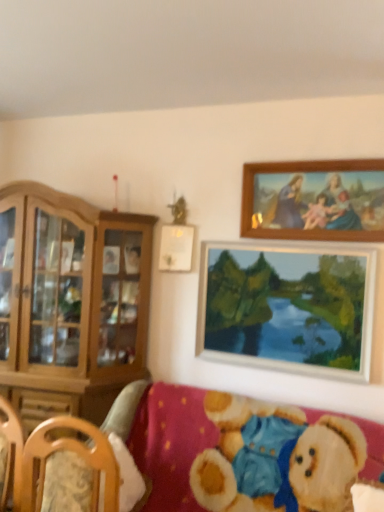
Question: Is wooden picture frame at upper center, the 2th picture frame in the bottom-to-top sequence, shorter than velvet teddy bear at lower right?

Choices:
 (A) yes
 (B) no

Answer: (A)

Question: Considering the relative positions of wooden picture frame at upper center, which ranks as the 2th picture frame in top-to-bottom order, and velvet teddy bear at lower right in the image provided, is wooden picture frame at upper center, which ranks as the 2th picture frame in top-to-bottom order, in front of velvet teddy bear at lower right?

Choices:
 (A) yes
 (B) no

Answer: (B)

Question: Is the depth of wooden picture frame at upper center, which ranks as the 2th picture frame in top-to-bottom order, greater than that of velvet teddy bear at lower right?

Choices:
 (A) no
 (B) yes

Answer: (B)

Question: From the image's perspective, does wooden picture frame at upper center, which ranks as the 2th picture frame in top-to-bottom order, appear lower than velvet teddy bear at lower right?

Choices:
 (A) no
 (B) yes

Answer: (A)

Question: From a real-world perspective, is wooden picture frame at upper center, the 2th picture frame in the bottom-to-top sequence, under velvet teddy bear at lower right?

Choices:
 (A) yes
 (B) no

Answer: (B)

Question: In terms of size, does wooden picture frame at upper center, which ranks as the 2th picture frame in top-to-bottom order, appear bigger or smaller than light brown wood cabinet at left?

Choices:
 (A) small
 (B) big

Answer: (A)

Question: Is wooden picture frame at upper center, the 2th picture frame in the bottom-to-top sequence, situated inside light brown wood cabinet at left or outside?

Choices:
 (A) outside
 (B) inside

Answer: (A)

Question: From a real-world perspective, is wooden picture frame at upper center, which ranks as the 2th picture frame in top-to-bottom order, above or below light brown wood cabinet at left?

Choices:
 (A) below
 (B) above

Answer: (B)

Question: Visually, is wooden picture frame at upper center, the 2th picture frame in the bottom-to-top sequence, positioned to the left or to the right of light brown wood cabinet at left?

Choices:
 (A) right
 (B) left

Answer: (A)

Question: Looking at the image, does light brown wood cabinet at left seem bigger or smaller compared to velvet teddy bear at lower right?

Choices:
 (A) small
 (B) big

Answer: (B)

Question: Considering the positions of light brown wood cabinet at left and velvet teddy bear at lower right in the image, is light brown wood cabinet at left taller or shorter than velvet teddy bear at lower right?

Choices:
 (A) tall
 (B) short

Answer: (A)

Question: From a real-world perspective, is light brown wood cabinet at left physically located above or below velvet teddy bear at lower right?

Choices:
 (A) above
 (B) below

Answer: (A)

Question: Is light brown wood cabinet at left to the left or to the right of velvet teddy bear at lower right in the image?

Choices:
 (A) right
 (B) left

Answer: (B)

Question: From a real-world perspective, is velvet teddy bear at lower right positioned above or below wooden picture frame at upper center, which ranks as the 2th picture frame in top-to-bottom order?

Choices:
 (A) above
 (B) below

Answer: (B)

Question: In the image, is velvet teddy bear at lower right positioned in front of or behind wooden picture frame at upper center, which ranks as the 2th picture frame in top-to-bottom order?

Choices:
 (A) behind
 (B) front

Answer: (B)